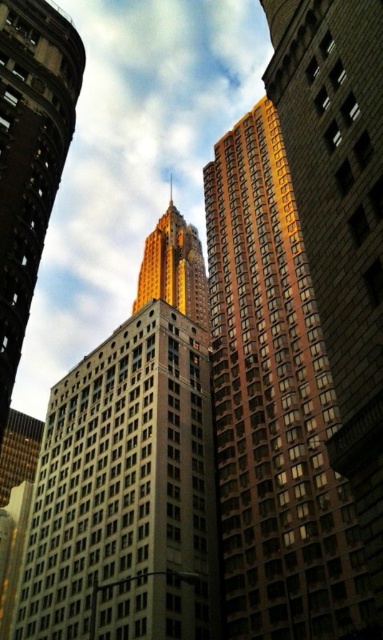
In the scene shown: Can you confirm if brown brick building at center is shorter than matte glass skyscraper at center?

No, brown brick building at center is not shorter than matte glass skyscraper at center.

Who is shorter, brown brick building at center or matte glass skyscraper at center?

matte glass skyscraper at center is shorter.

I want to click on brown brick building at center, so click(273, 406).

Locate an element on the screen. Image resolution: width=383 pixels, height=640 pixels. brown brick building at center is located at coordinates (273, 406).

Is matte glass skyscraper at center positioned at the back of gold reflective skyscraper at center?

No, it is in front of gold reflective skyscraper at center.

Who is positioned more to the left, matte glass skyscraper at center or gold reflective skyscraper at center?

matte glass skyscraper at center

What are the coordinates of `matte glass skyscraper at center` in the screenshot? It's located at (29, 156).

What do you see at coordinates (126, 492) in the screenshot? Image resolution: width=383 pixels, height=640 pixels. I see `white concrete building at center` at bounding box center [126, 492].

Image resolution: width=383 pixels, height=640 pixels. I want to click on white concrete building at center, so click(x=126, y=492).

Is point (80, 499) less distant than point (0, 8)?

No, (80, 499) is further to viewer.

The width and height of the screenshot is (383, 640). Find the location of `white concrete building at center`. white concrete building at center is located at coordinates (126, 492).